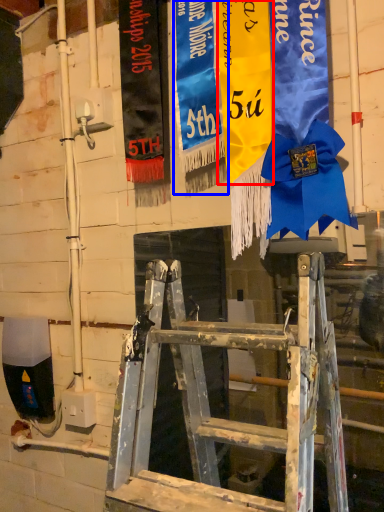
Question: Which of the following is the farthest to the observer, tapestry (highlighted by a red box) or tapestry (highlighted by a blue box)?

Choices:
 (A) tapestry
 (B) tapestry

Answer: (B)